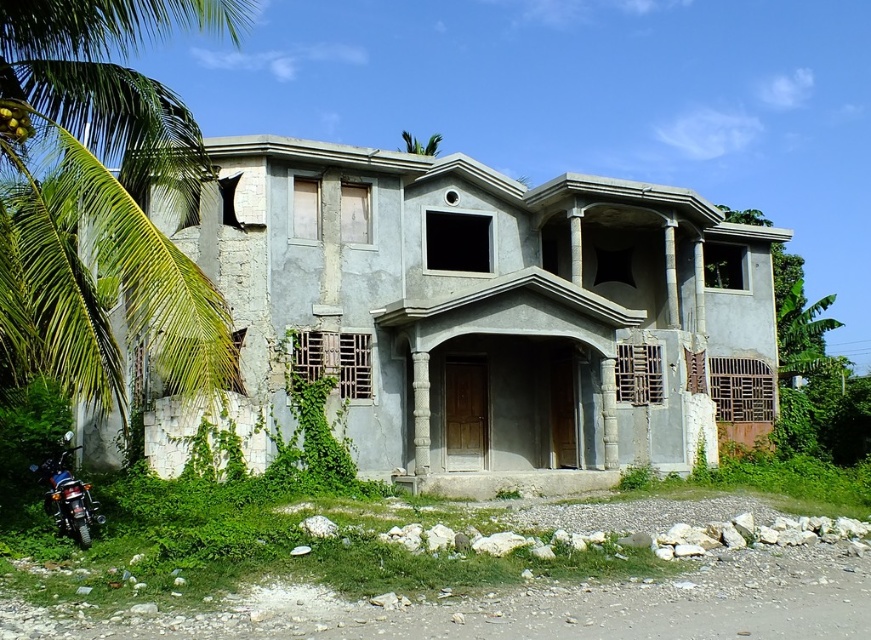
Between green leafy palm tree at left and shiny black motorbike at lower left, which one has more height?

green leafy palm tree at left

You are a GUI agent. You are given a task and a screenshot of the screen. Output one action in this format:
    pyautogui.click(x=<x>, y=<y>)
    Task: Click on the green leafy palm tree at left
    
    Given the screenshot: What is the action you would take?
    pyautogui.click(x=100, y=200)